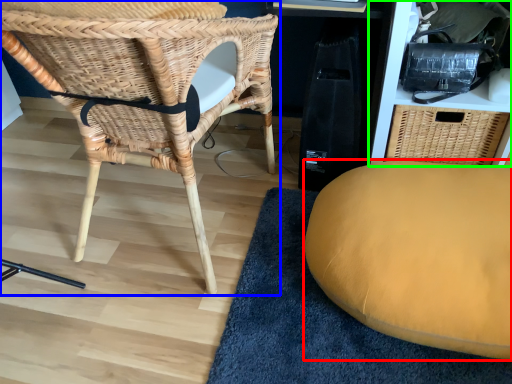
Question: Based on their relative distances, which object is nearer to furniture (highlighted by a red box)? Choose from chair (highlighted by a blue box) and shelf (highlighted by a green box).

Choices:
 (A) chair
 (B) shelf

Answer: (B)